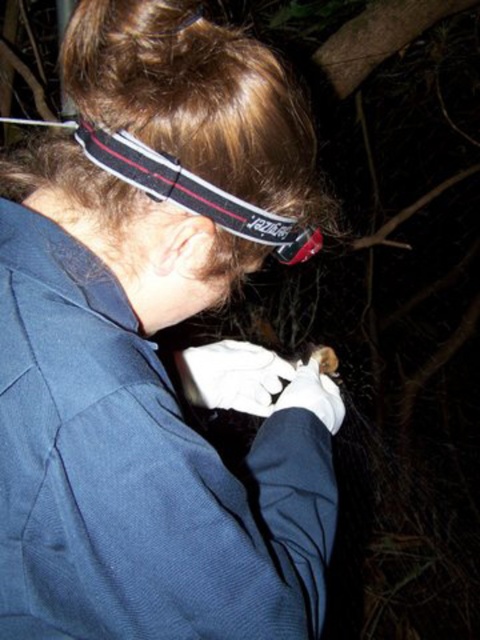
Which is above, dark blue fabric at center or black fabric headband at upper center?

black fabric headband at upper center is above.

Is dark blue fabric at center taller than black fabric headband at upper center?

Correct, dark blue fabric at center is much taller as black fabric headband at upper center.

Between point (75, 346) and point (231, 196), which one is positioned in front?

Point (75, 346)

What are the coordinates of `dark blue fabric at center` in the screenshot? It's located at (152, 342).

Is black fabric headband at upper center positioned before white leather glove at lower center?

Yes, black fabric headband at upper center is closer to the viewer.

Who is more forward, (90,150) or (181,376)?

Positioned in front is point (90,150).

Is point (106, 170) closer to camera compared to point (211, 380)?

Yes, it is in front of point (211, 380).

At what (x,y) coordinates should I click in order to perform the action: click on black fabric headband at upper center. Please return your answer as a coordinate pair (x, y). Looking at the image, I should click on (193, 193).

Is dark blue fabric at center to the right of white leather glove at lower center from the viewer's perspective?

In fact, dark blue fabric at center is to the left of white leather glove at lower center.

Can you confirm if dark blue fabric at center is thinner than white leather glove at lower center?

No, dark blue fabric at center is not thinner than white leather glove at lower center.

Is point (127, 228) behind point (250, 369)?

No.

Locate an element on the screen. Image resolution: width=480 pixels, height=640 pixels. dark blue fabric at center is located at coordinates (152, 342).